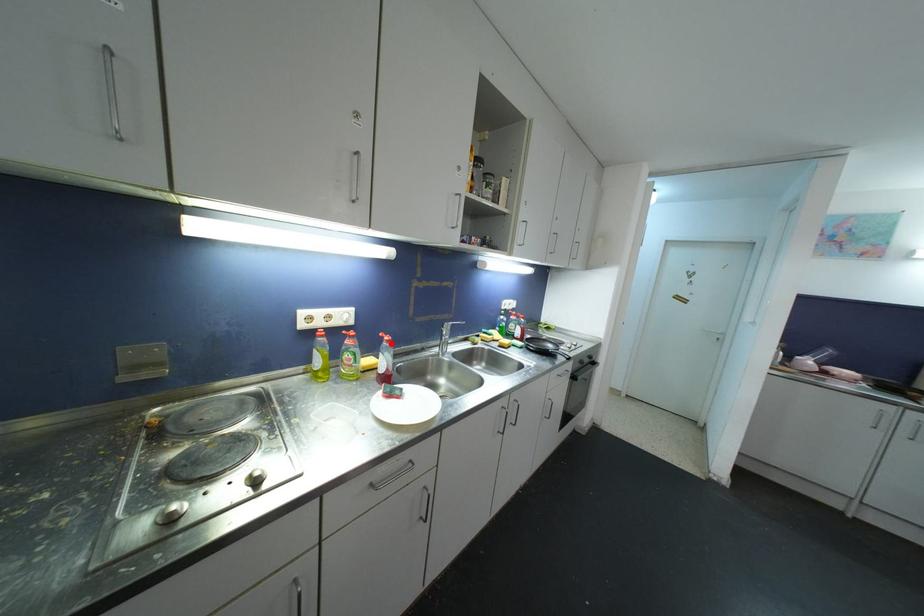
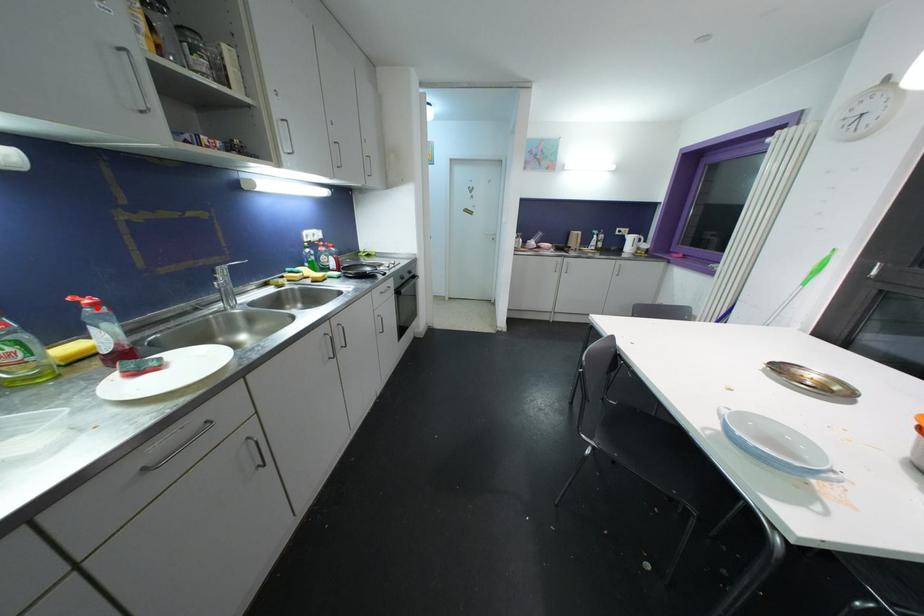
I am providing you with two images of the same scene from different viewpoints. A red point is marked on the first image and another point is marked on the second image. Is the marked point in image1 the same physical position as the marked point in image2?

Yes